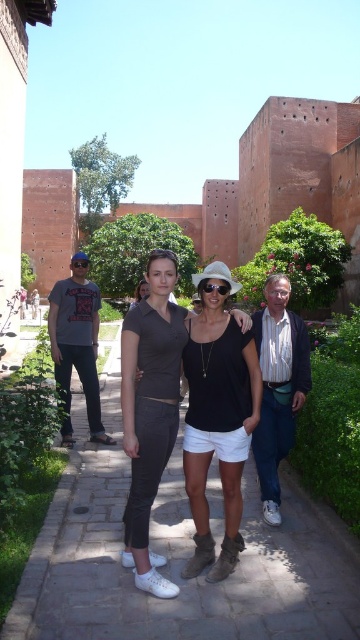
The height and width of the screenshot is (640, 360). Describe the element at coordinates (177, 564) in the screenshot. I see `paved stone path at center` at that location.

In the scene shown: Which of these two, paved stone path at center or matte gray dress at center, stands shorter?

Standing shorter between the two is paved stone path at center.

Between point (213, 592) and point (137, 307), which one is positioned behind?

Positioned behind is point (137, 307).

The height and width of the screenshot is (640, 360). I want to click on paved stone path at center, so click(177, 564).

In the scene shown: Does paved stone path at center have a greater width compared to black cotton tank top at center?

Correct, the width of paved stone path at center exceeds that of black cotton tank top at center.

Which is more to the left, paved stone path at center or black cotton tank top at center?

paved stone path at center

The height and width of the screenshot is (640, 360). I want to click on paved stone path at center, so click(x=177, y=564).

The width and height of the screenshot is (360, 640). In order to click on paved stone path at center in this screenshot , I will do `click(177, 564)`.

Where is `black cotton tank top at center`? This screenshot has height=640, width=360. black cotton tank top at center is located at coordinates (218, 426).